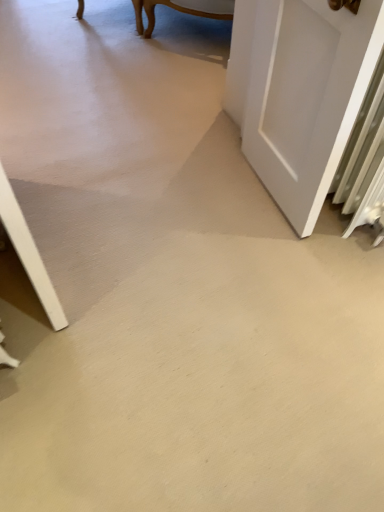
The height and width of the screenshot is (512, 384). In order to click on vacant space in front of white matte door at right in this screenshot , I will do `click(272, 265)`.